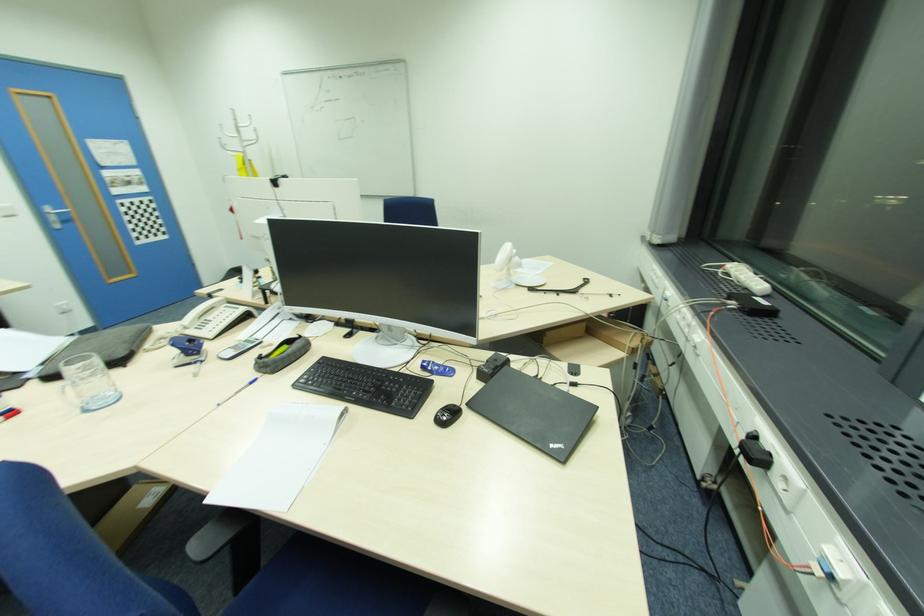
Find the location of a particular element. blue chair armrest is located at coordinates (215, 533).